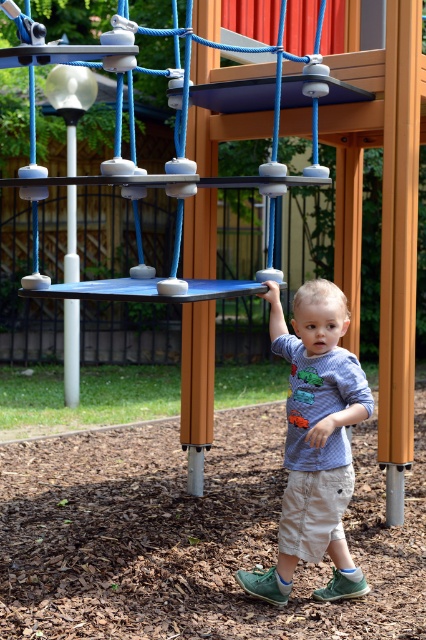
Question: Can you confirm if blue cotton shirt at center is positioned above blue rubber swing at center?

Choices:
 (A) no
 (B) yes

Answer: (A)

Question: Does blue cotton shirt at center lie behind blue rubber swing at center?

Choices:
 (A) yes
 (B) no

Answer: (A)

Question: Which object is farther from the camera taking this photo?

Choices:
 (A) blue rubber swing at center
 (B) blue cotton shirt at center

Answer: (B)

Question: Which point is closer to the camera?

Choices:
 (A) (134, 292)
 (B) (250, 577)

Answer: (A)

Question: Does blue cotton shirt at center appear on the left side of blue rubber swing at center?

Choices:
 (A) no
 (B) yes

Answer: (A)